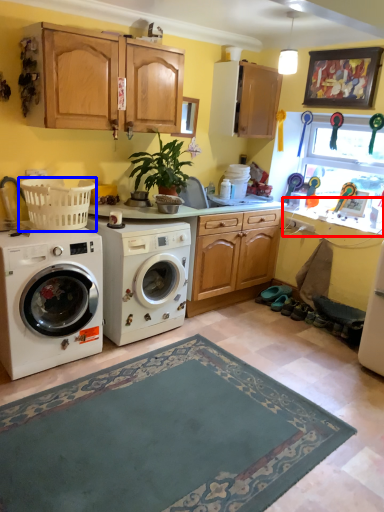
Question: Which point is closer to the camera, counter top (highlighted by a red box) or basket (highlighted by a blue box)?

Choices:
 (A) counter top
 (B) basket

Answer: (B)